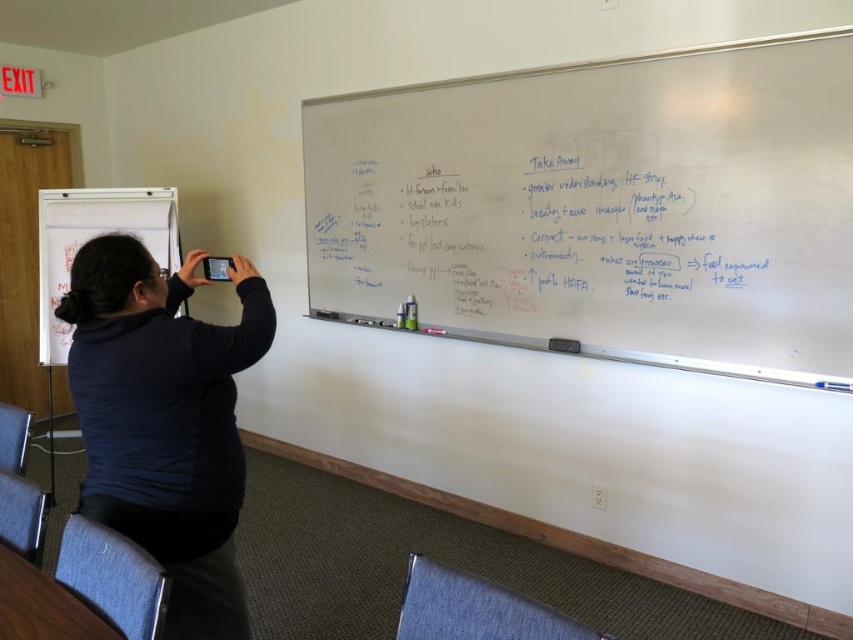
Question: Which of the following is the farthest from the observer?

Choices:
 (A) whiteboard at upper right
 (B) dark blue sweater at lower left
 (C) whiteboard at left

Answer: (C)

Question: Which of the following is the closest to the observer?

Choices:
 (A) whiteboard at upper right
 (B) whiteboard at left

Answer: (A)

Question: Does dark blue sweater at lower left appear on the right side of whiteboard at left?

Choices:
 (A) no
 (B) yes

Answer: (B)

Question: Based on their relative distances, which object is farther from the whiteboard at upper right?

Choices:
 (A) dark blue sweater at lower left
 (B) whiteboard at left

Answer: (B)

Question: Considering the relative positions of whiteboard at upper right and whiteboard at left in the image provided, where is whiteboard at upper right located with respect to whiteboard at left?

Choices:
 (A) below
 (B) above

Answer: (B)

Question: Where is dark blue sweater at lower left located in relation to whiteboard at left in the image?

Choices:
 (A) below
 (B) above

Answer: (A)